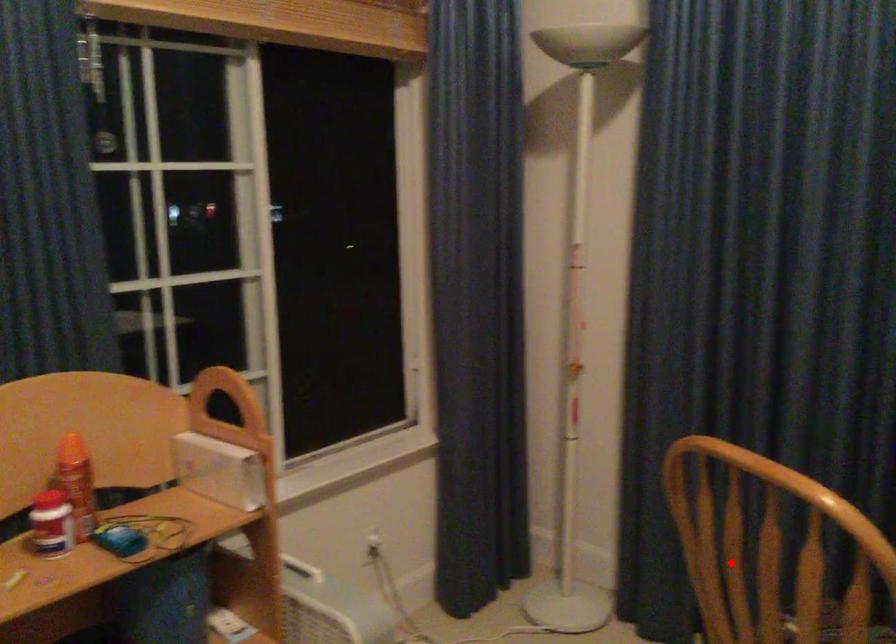
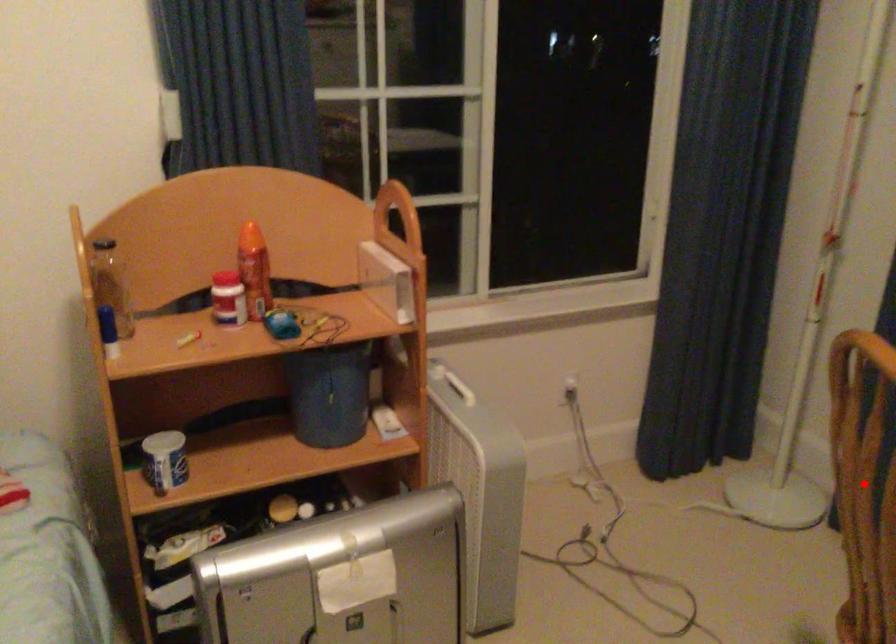
I am providing you with two images of the same scene from different viewpoints. A red point is marked on the first image and another point is marked on the second image. Is the red point in image1 aligned with the point shown in image2?

Yes